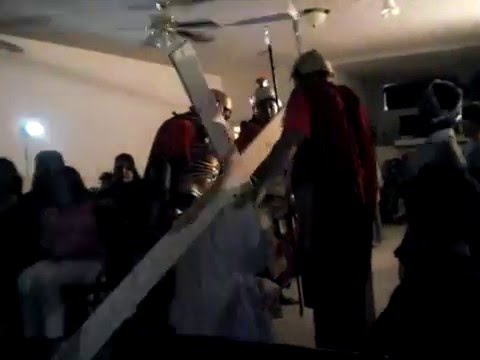
You are a GUI agent. You are given a task and a screenshot of the screen. Output one action in this format:
    pyautogui.click(x=<x>, y=<y>)
    Task: Click on the wall
    The height and width of the screenshot is (360, 480).
    Given the screenshot: What is the action you would take?
    pyautogui.click(x=93, y=128)